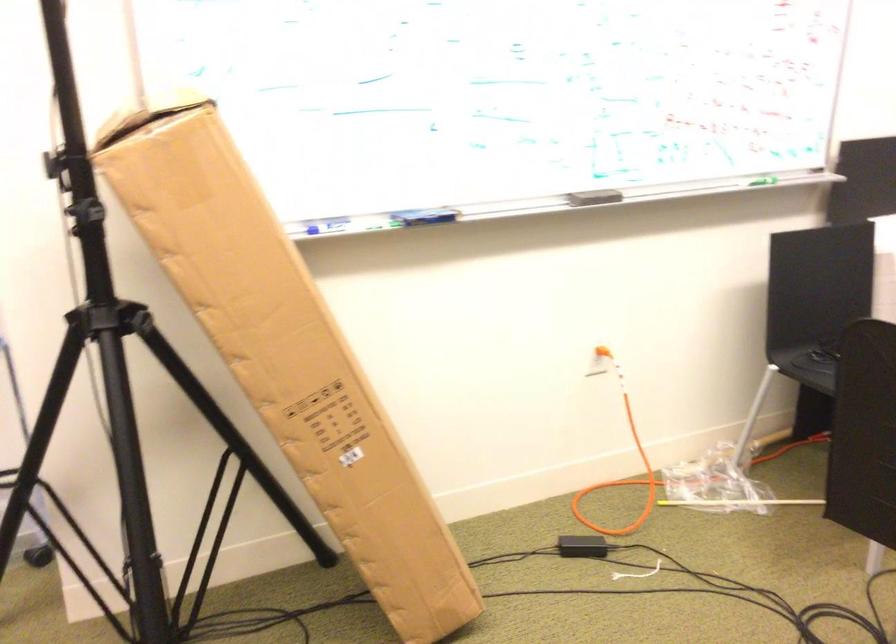
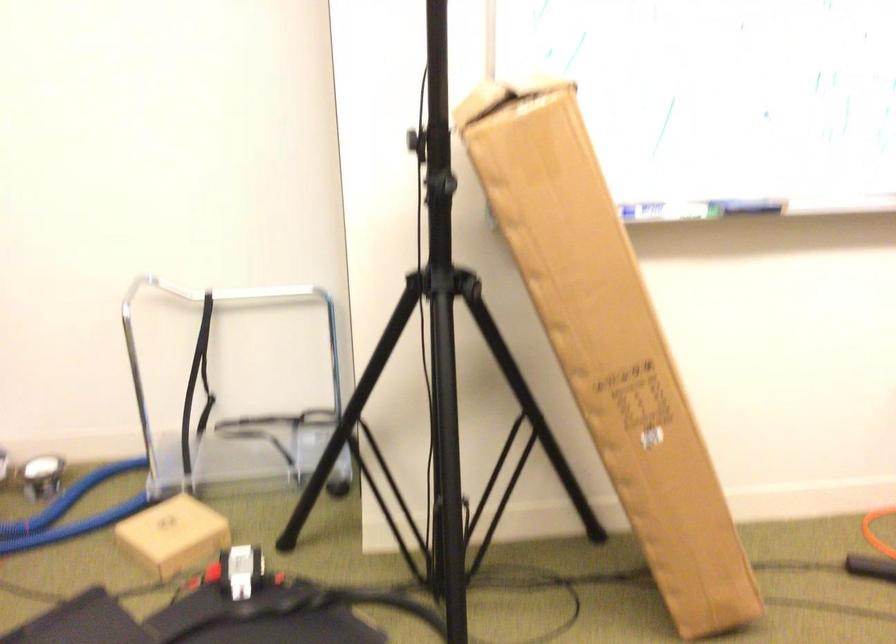
Question: The camera is either moving clockwise (left) or counter-clockwise (right) around the object. The first image is from the beginning of the video and the second image is from the end. Is the camera moving left or right when shooting the video?

Choices:
 (A) Left
 (B) Right

Answer: (B)